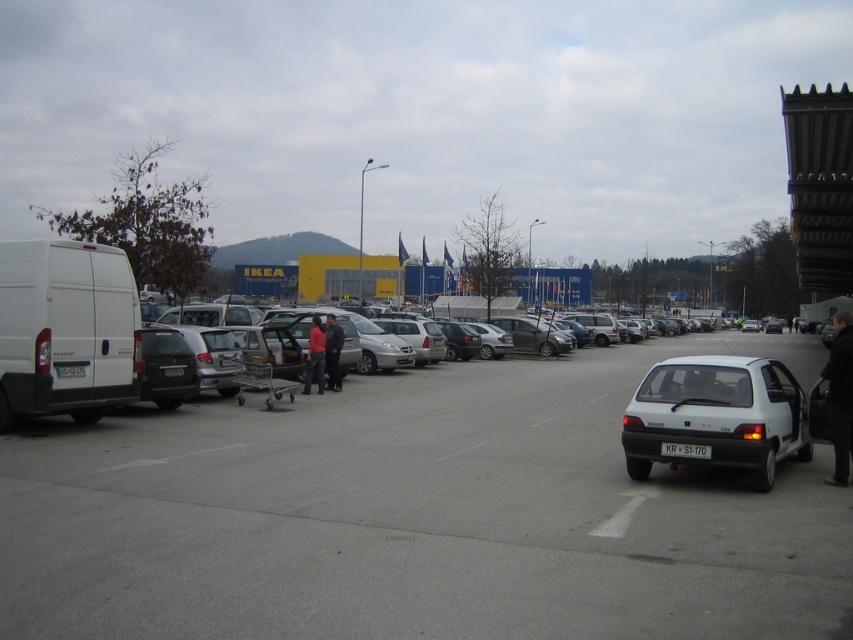
Is white matte car at center below white matte hatchback at lower right?

Yes, white matte car at center is below white matte hatchback at lower right.

Does white matte car at center appear over white matte hatchback at lower right?

No, white matte car at center is not above white matte hatchback at lower right.

Is point (318, 470) behind point (763, 416)?

Yes.

Identify the location of white matte car at center. (416, 515).

Is white matte hatchback at lower right behind black leather jacket at lower right?

No, it is not.

Locate an element on the screen. The height and width of the screenshot is (640, 853). white matte hatchback at lower right is located at coordinates (715, 417).

The image size is (853, 640). What are the coordinates of `white matte hatchback at lower right` in the screenshot? It's located at (715, 417).

Is white matte van at left to the left of white matte hatchback at lower right from the viewer's perspective?

Indeed, white matte van at left is positioned on the left side of white matte hatchback at lower right.

In the scene shown: How distant is white matte van at left from white matte hatchback at lower right?

A distance of 8.28 meters exists between white matte van at left and white matte hatchback at lower right.

Locate an element on the screen. This screenshot has height=640, width=853. white matte van at left is located at coordinates (67, 330).